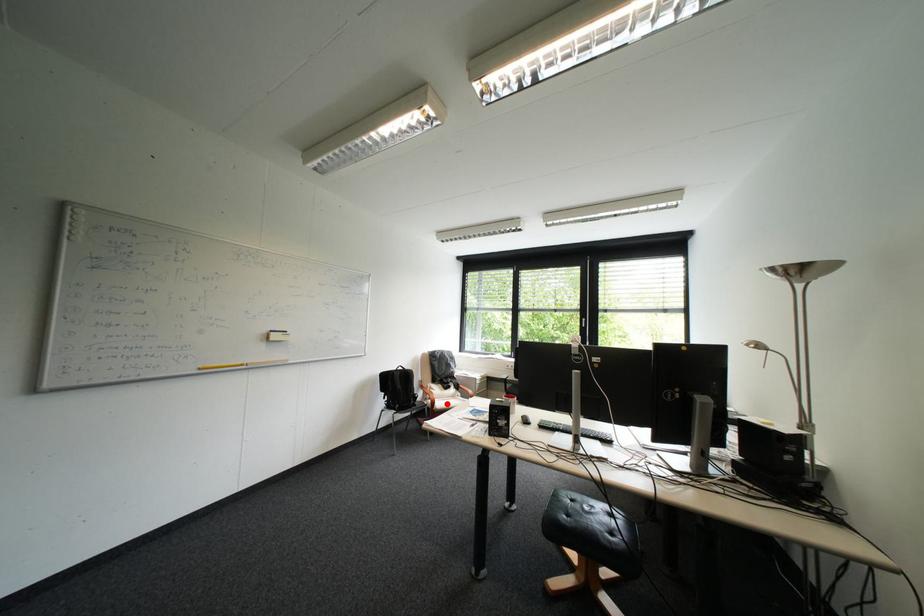
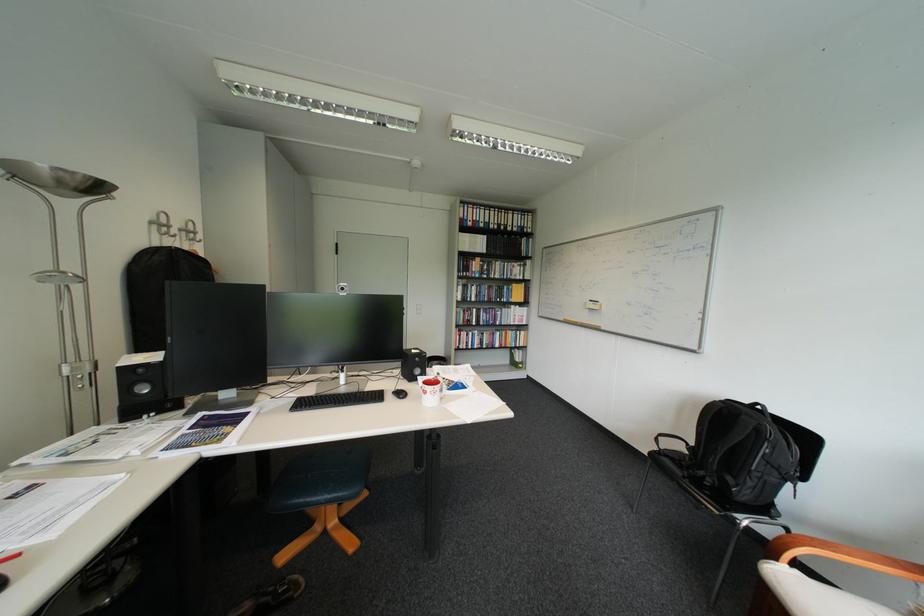
Where in the second image is the point corresponding to the highlighted location from the first image?

(788, 560)